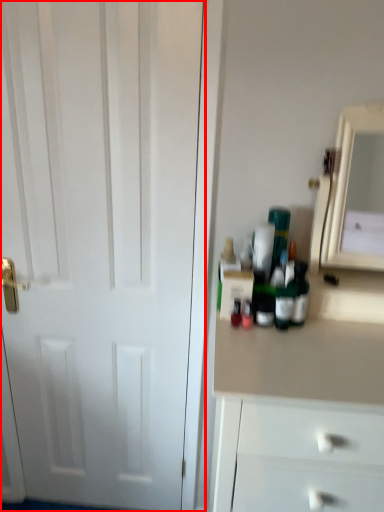
Question: Observing the image, what is the correct spatial positioning of door (annotated by the red box) in reference to medicine cabinet?

Choices:
 (A) right
 (B) left

Answer: (B)